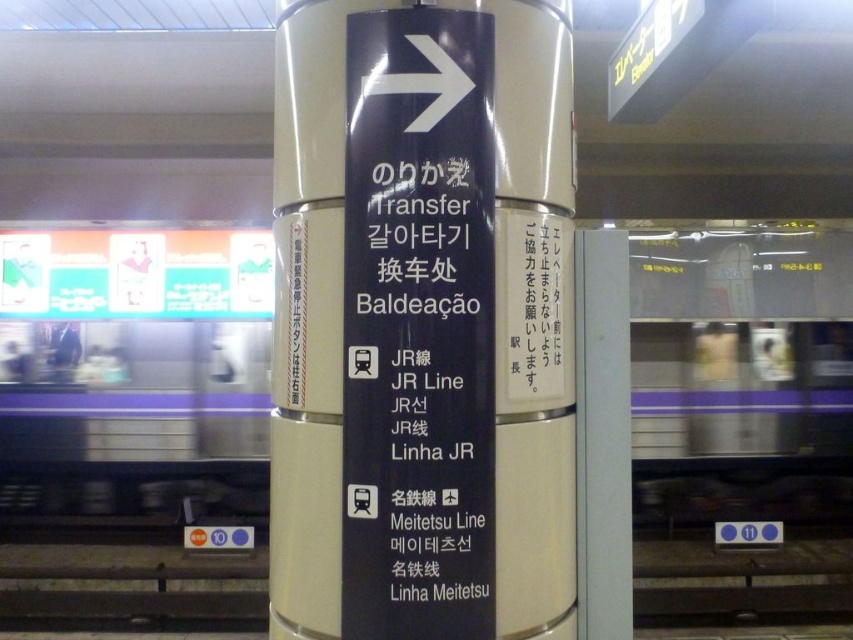
You are a traveler at the train station and need to read the black plastic sign at center. However, there is a metallic silver train at center blocking your view. Can you see the sign clearly?

The metallic silver train at center is larger in size than black plastic sign at center, so the train is blocking the view of the sign, making it difficult to see clearly.

You are waiting at the train station platform and see the black glossy signpost at center and the metallic silver train at center. Which object is closer to you?

The black glossy signpost at center is closer to you because it is in front of the metallic silver train at center.

You are standing on a train station platform and see the black glossy signpost at center and the black plastic sign at center. Which one is closer to you?

The black glossy signpost at center is closer to you because it is further to the viewer than the black plastic sign at center.